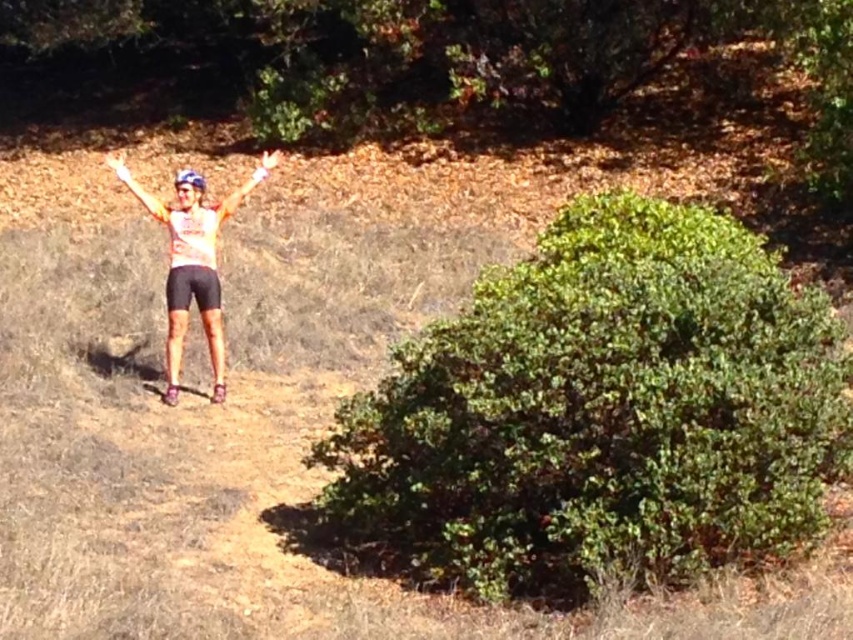
Can you confirm if orange matte tank top at center is bigger than matte orange glove at center?

Actually, orange matte tank top at center might be smaller than matte orange glove at center.

Between point (257, 172) and point (119, 156), which one is positioned behind?

The point (119, 156) is behind.

Who is more distant from viewer, (184, 288) or (129, 177)?

The point (129, 177) is behind.

You are a GUI agent. You are given a task and a screenshot of the screen. Output one action in this format:
    pyautogui.click(x=<x>, y=<y>)
    Task: Click on the orange matte tank top at center
    The height and width of the screenshot is (640, 853).
    Given the screenshot: What is the action you would take?
    pyautogui.click(x=193, y=269)

Between orange matte tank top at center and matte orange arm at center, which one appears on the right side from the viewer's perspective?

From the viewer's perspective, matte orange arm at center appears more on the right side.

Which is above, orange matte tank top at center or matte orange arm at center?

matte orange arm at center is higher up.

Who is more forward, (181, 308) or (276, 164)?

Point (181, 308) is in front.

Identify the location of orange matte tank top at center. (193, 269).

Between point (641, 330) and point (108, 163), which one is positioned in front?

Point (641, 330) is more forward.

Can you confirm if green leafy bush at lower right is positioned to the left of matte orange glove at center?

Incorrect, green leafy bush at lower right is not on the left side of matte orange glove at center.

Is point (447, 545) closer to viewer compared to point (108, 152)?

Yes, it is in front of point (108, 152).

Locate an element on the screen. green leafy bush at lower right is located at coordinates (601, 413).